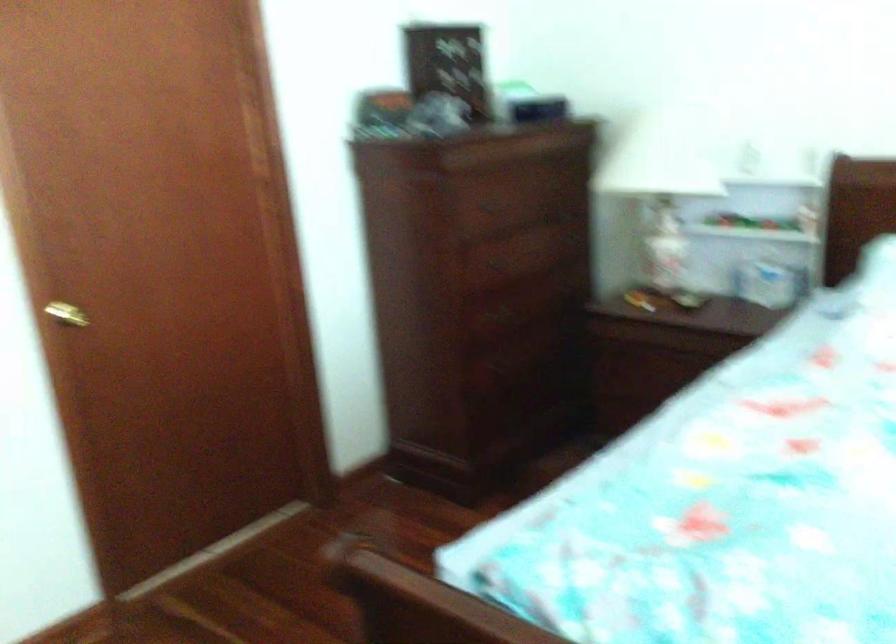
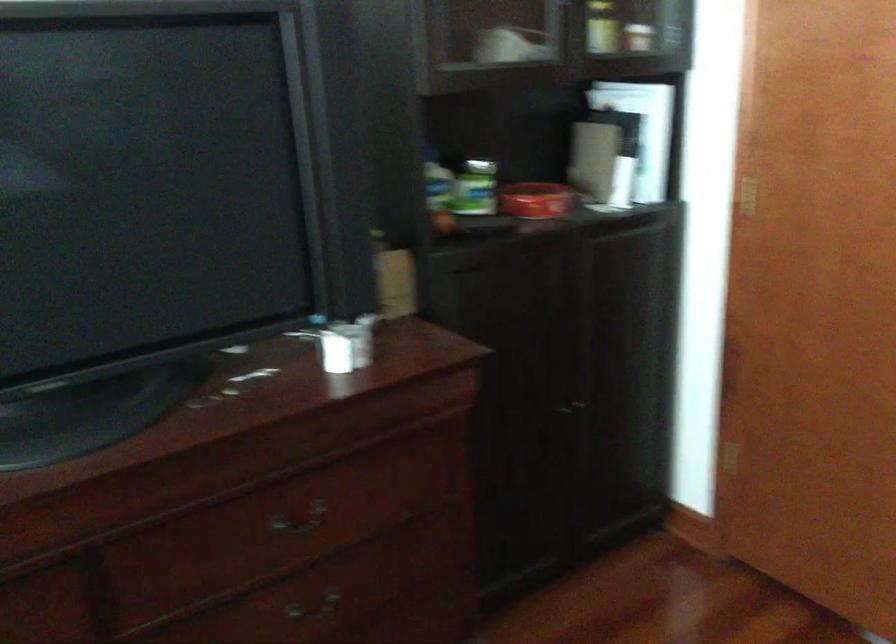
Based on the continuous images, in which direction is the camera rotating?

The camera's rotation is toward left-down.